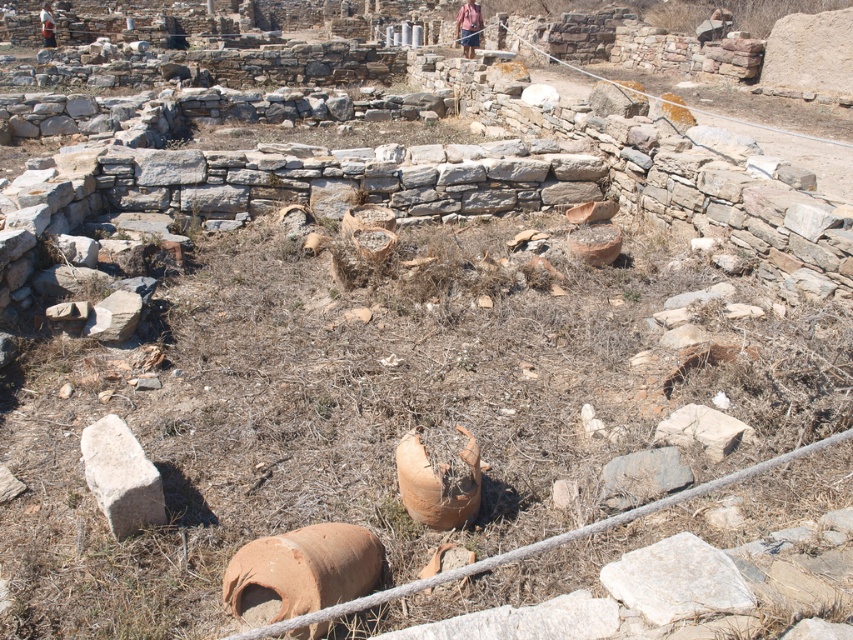
Who is positioned more to the right, brown leather bag at upper center or camouflage fabric shirt at upper left?

brown leather bag at upper center is more to the right.

Does brown leather bag at upper center come behind camouflage fabric shirt at upper left?

No.

Who is more distant from viewer, (480, 12) or (44, 44)?

Point (44, 44)

Identify the location of brown leather bag at upper center. This screenshot has width=853, height=640. pyautogui.click(x=468, y=28).

Between white rough stone at center and white rough stone at lower left, which one is positioned higher?

white rough stone at lower left is higher up.

From the picture: Is white rough stone at center positioned behind white rough stone at lower left?

No.

Does point (709, 611) come behind point (125, 460)?

No, it is in front of (125, 460).

I want to click on white rough stone at center, so click(x=677, y=579).

Between white rough stone at center and camouflage fabric shirt at upper left, which one is positioned higher?

Positioned higher is camouflage fabric shirt at upper left.

Does white rough stone at center appear over camouflage fabric shirt at upper left?

No, white rough stone at center is not above camouflage fabric shirt at upper left.

Is point (712, 572) positioned behind point (48, 32)?

No, (712, 572) is closer to viewer.

I want to click on white rough stone at center, so click(x=677, y=579).